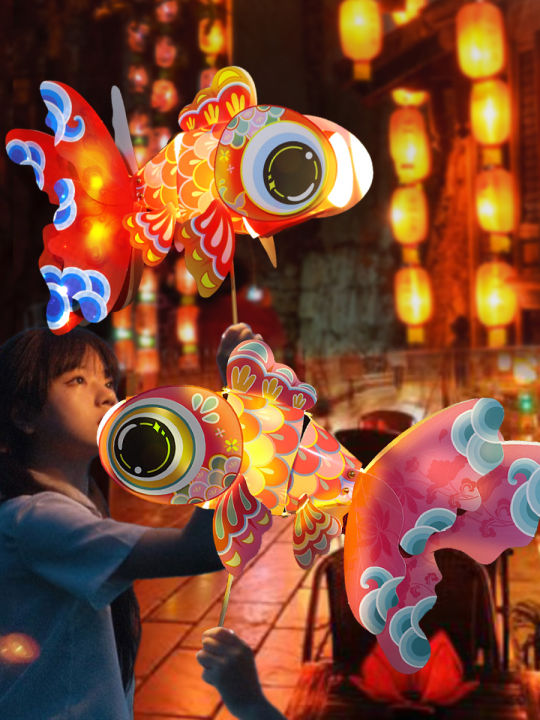
At what (x,y) coordinates should I click in order to perform the action: click on table decor. Please return your answer as a coordinate pair (x, y). Looking at the image, I should click on (440, 678), (380, 423).